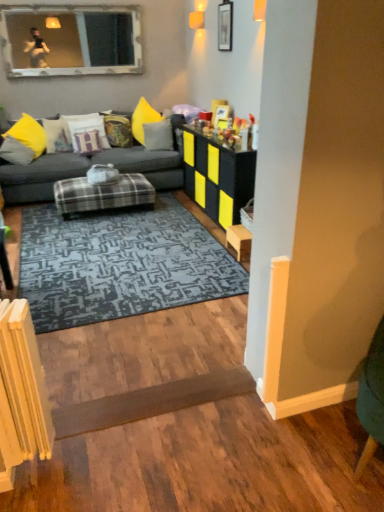
Question: Looking at their shapes, would you say velvet yellow pillow at center, arranged as the 4th pillow when viewed from the left, is wider or thinner than wooden picture frame at upper center?

Choices:
 (A) thin
 (B) wide

Answer: (B)

Question: Choose the correct answer: Is velvet yellow pillow at center, positioned as the 2th pillow in right-to-left order, inside wooden picture frame at upper center or outside it?

Choices:
 (A) inside
 (B) outside

Answer: (B)

Question: Estimate the real-world distances between objects in this image. Which object is farther from the blue textured rug at center?

Choices:
 (A) gray textured pillow at center, which is counted as the fifth pillow, starting from the left
 (B) velvet yellow pillow at center, arranged as the 4th pillow when viewed from the left
 (C) plaid fabric ottoman at center, which is the 2th table from right to left
 (D) dark gray fabric couch at center
 (E) velvet purple pillow at center, arranged as the third pillow when viewed from the left

Answer: (B)

Question: Which object is the farthest from the dark gray fabric couch at center?

Choices:
 (A) black textured cabinet at center, the second table in the left-to-right sequence
 (B) velvet purple pillow at center, placed as the third pillow when sorted from right to left
 (C) wooden stool at right
 (D) gray textured pillow at center, which is counted as the fifth pillow, starting from the left
 (E) plaid fabric ottoman at center, the first table when ordered from left to right

Answer: (C)